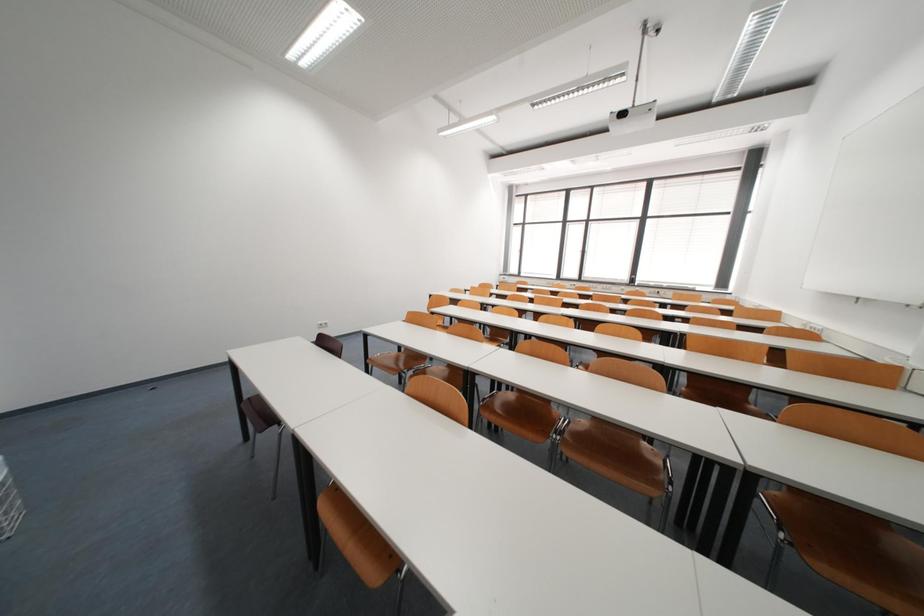
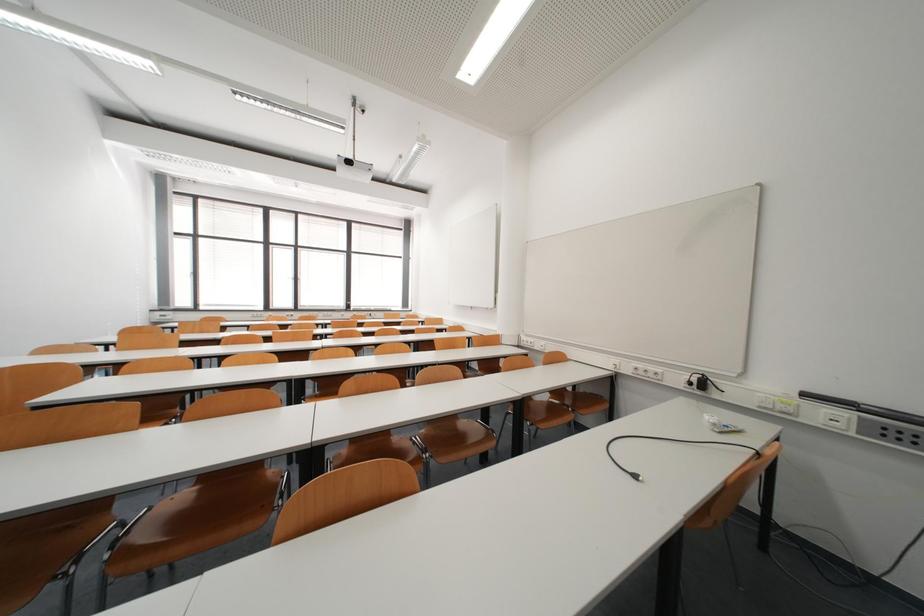
Question: The camera is either moving clockwise (left) or counter-clockwise (right) around the object. The first image is from the beginning of the video and the second image is from the end. Is the camera moving left or right when shooting the video?

Choices:
 (A) Left
 (B) Right

Answer: (A)